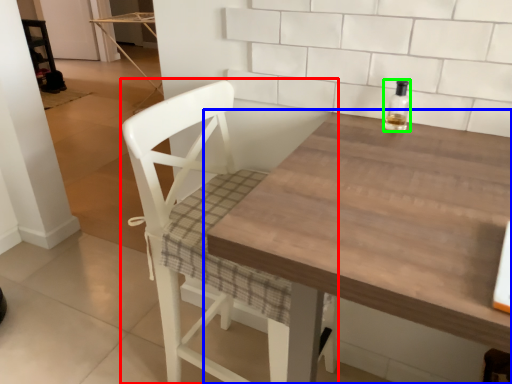
Question: Which object is positioned farthest from chair (highlighted by a red box)? Select from table (highlighted by a blue box) and bottle (highlighted by a green box).

Choices:
 (A) table
 (B) bottle

Answer: (B)